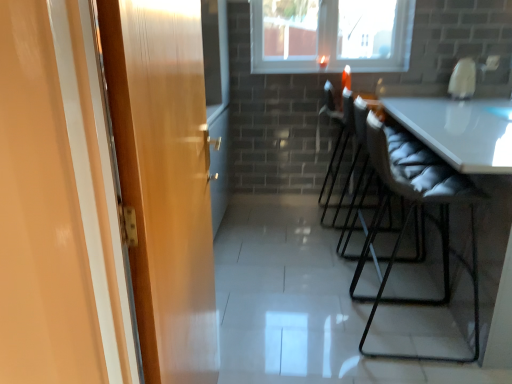
Where is `free region under matte gray chair at center right, the second chair when ordered from front to back (from a real-world perspective)`? Image resolution: width=512 pixels, height=384 pixels. free region under matte gray chair at center right, the second chair when ordered from front to back (from a real-world perspective) is located at coordinates (352, 241).